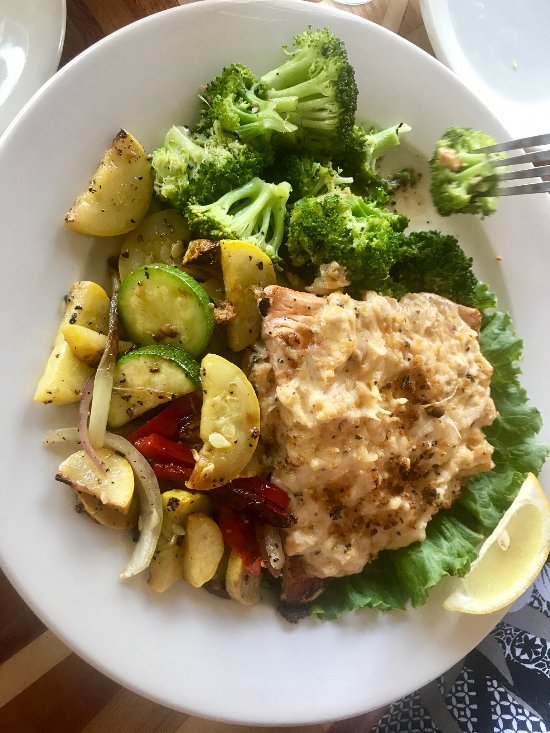
Find the location of `brown wooden table`. brown wooden table is located at coordinates (87, 17).